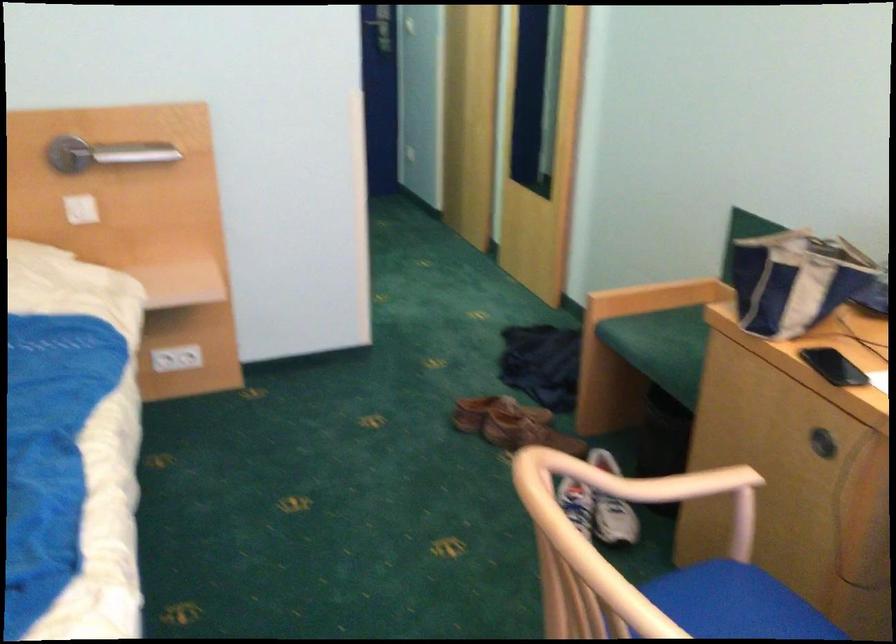
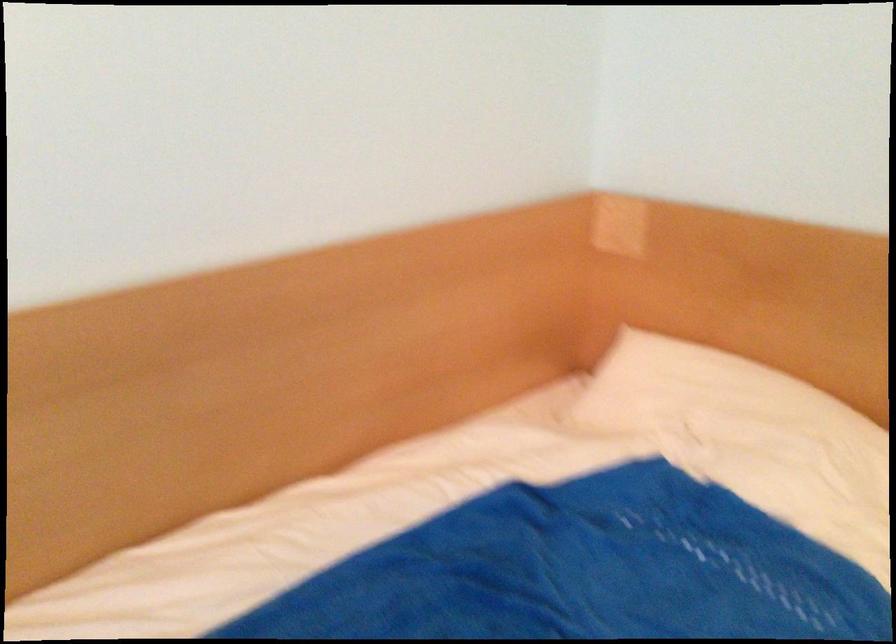
Question: Based on the continuous images, in which direction is the camera rotating? Reply with the corresponding letter.

Choices:
 (A) Left
 (B) Right
 (C) Up
 (D) Down

Answer: (A)